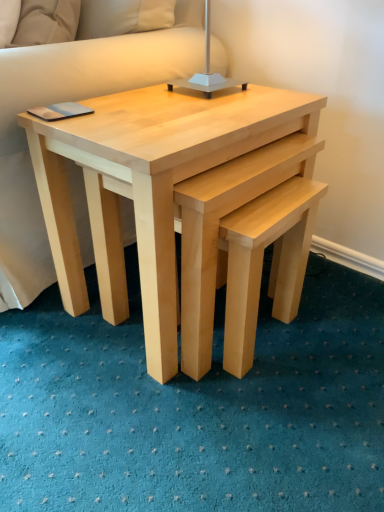
Question: Are metallic silver table lamp at upper center and natural wood nesting tables at center far apart?

Choices:
 (A) yes
 (B) no

Answer: (B)

Question: From a real-world perspective, is metallic silver table lamp at upper center on natural wood nesting tables at center?

Choices:
 (A) no
 (B) yes

Answer: (B)

Question: Does metallic silver table lamp at upper center contain natural wood nesting tables at center?

Choices:
 (A) yes
 (B) no

Answer: (B)

Question: From the image's perspective, is metallic silver table lamp at upper center under natural wood nesting tables at center?

Choices:
 (A) no
 (B) yes

Answer: (A)

Question: Is metallic silver table lamp at upper center at the left side of natural wood nesting tables at center?

Choices:
 (A) yes
 (B) no

Answer: (B)

Question: Is metallic silver table lamp at upper center turned away from natural wood nesting tables at center?

Choices:
 (A) yes
 (B) no

Answer: (B)

Question: Does natural wood nesting tables at center have a lesser height compared to metallic silver table lamp at upper center?

Choices:
 (A) yes
 (B) no

Answer: (B)

Question: Does natural wood nesting tables at center turn towards metallic silver table lamp at upper center?

Choices:
 (A) yes
 (B) no

Answer: (B)

Question: Is metallic silver table lamp at upper center inside natural wood nesting tables at center?

Choices:
 (A) yes
 (B) no

Answer: (B)

Question: Can you confirm if natural wood nesting tables at center is positioned to the left of metallic silver table lamp at upper center?

Choices:
 (A) no
 (B) yes

Answer: (B)

Question: From the image's perspective, does natural wood nesting tables at center appear lower than metallic silver table lamp at upper center?

Choices:
 (A) no
 (B) yes

Answer: (B)

Question: Is natural wood nesting tables at center facing away from metallic silver table lamp at upper center?

Choices:
 (A) yes
 (B) no

Answer: (B)

Question: Visually, is metallic silver table lamp at upper center positioned to the left or to the right of natural wood nesting tables at center?

Choices:
 (A) left
 (B) right

Answer: (B)